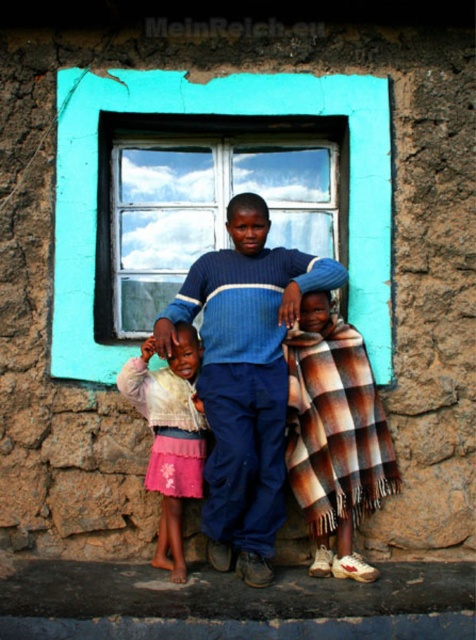
Question: Is blue knitted sweater at center to the left of light pink fabric skirt at lower left from the viewer's perspective?

Choices:
 (A) no
 (B) yes

Answer: (A)

Question: Which object appears closest to the camera in this image?

Choices:
 (A) teal glass window at center
 (B) blue knitted sweater at center

Answer: (B)

Question: Which of these objects is positioned farthest from the plaid woolen blanket at center?

Choices:
 (A) light pink fabric skirt at lower left
 (B) blue knitted sweater at center

Answer: (A)

Question: Can you confirm if teal glass window at center is wider than plaid woolen blanket at center?

Choices:
 (A) no
 (B) yes

Answer: (B)

Question: Does plaid woolen blanket at center come behind light pink fabric skirt at lower left?

Choices:
 (A) yes
 (B) no

Answer: (A)

Question: Which of the following is the farthest from the observer?

Choices:
 (A) (263, 374)
 (B) (198, 492)
 (C) (362, 364)
 (D) (217, 122)

Answer: (D)